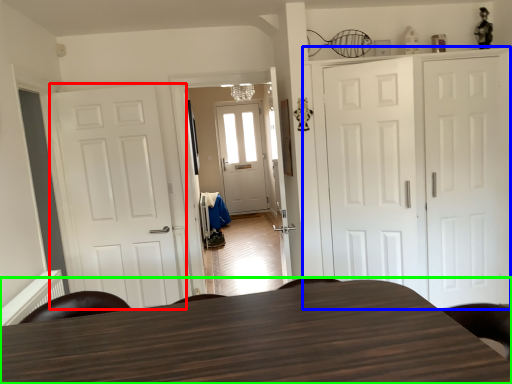
Question: Which is nearer to the door (highlighted by a red box)? cabinetry (highlighted by a blue box) or table (highlighted by a green box).

Choices:
 (A) cabinetry
 (B) table

Answer: (A)